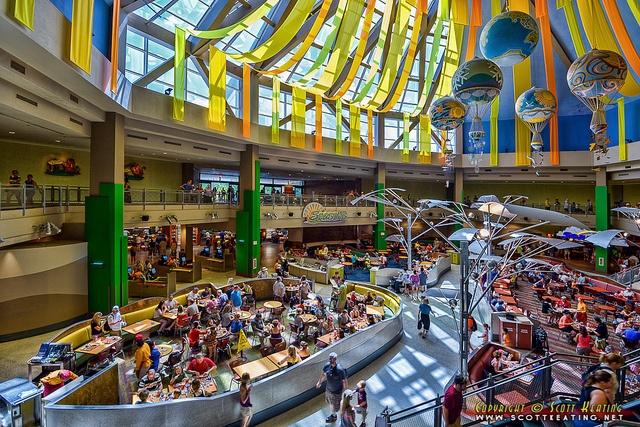
Locate an element on the screen. The width and height of the screenshot is (640, 427). trash can is located at coordinates (523, 332).